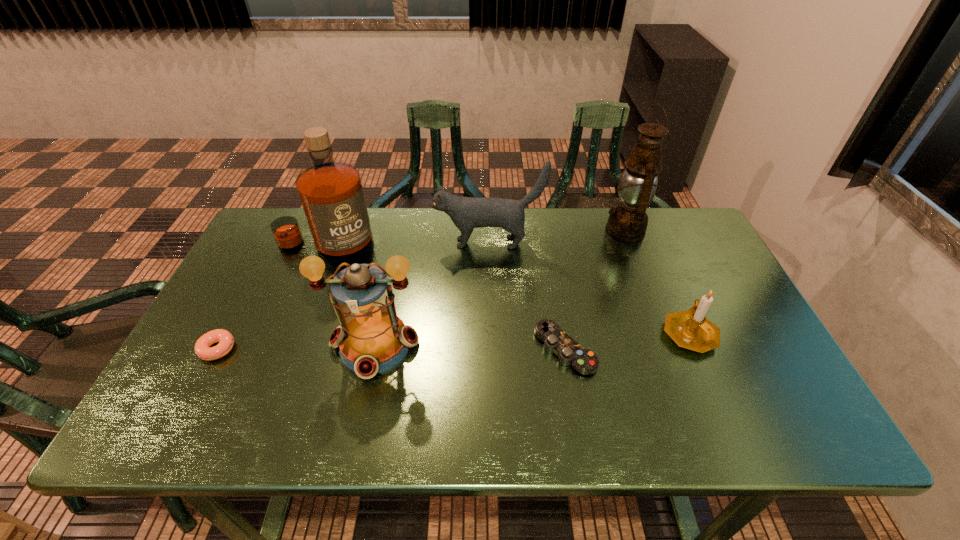
Locate an element on the screen. Image resolution: width=960 pixels, height=540 pixels. blank space located 0.320m at the face of the cat is located at coordinates (331, 243).

The height and width of the screenshot is (540, 960). What are the coordinates of `vacant region located at the face of the cat` in the screenshot? It's located at (376, 243).

At what (x,y) coordinates should I click in order to perform the action: click on vacant space located 0.050m on the front-facing side of the lantern. Please return your answer as a coordinate pair (x, y). Looking at the image, I should click on (363, 402).

Locate an element on the screen. free space located on the back of the fifth tallest object is located at coordinates (640, 219).

At what (x,y) coordinates should I click in order to perform the action: click on vacant space situated 0.240m on the right of the control. Please return your answer as a coordinate pair (x, y). The width and height of the screenshot is (960, 540). Looking at the image, I should click on coord(692,349).

Where is `blank space located on the back of the doughnut`? The height and width of the screenshot is (540, 960). blank space located on the back of the doughnut is located at coordinates (250, 287).

Identify the location of oil lamp located at the far edge. (627, 222).

Identify the location of liquor located in the far edge section of the desktop. The image size is (960, 540). (331, 193).

Locate an element on the screen. The width and height of the screenshot is (960, 540). cat located in the far edge section of the desktop is located at coordinates (467, 213).

This screenshot has height=540, width=960. I want to click on liquor present at the left edge, so click(x=331, y=193).